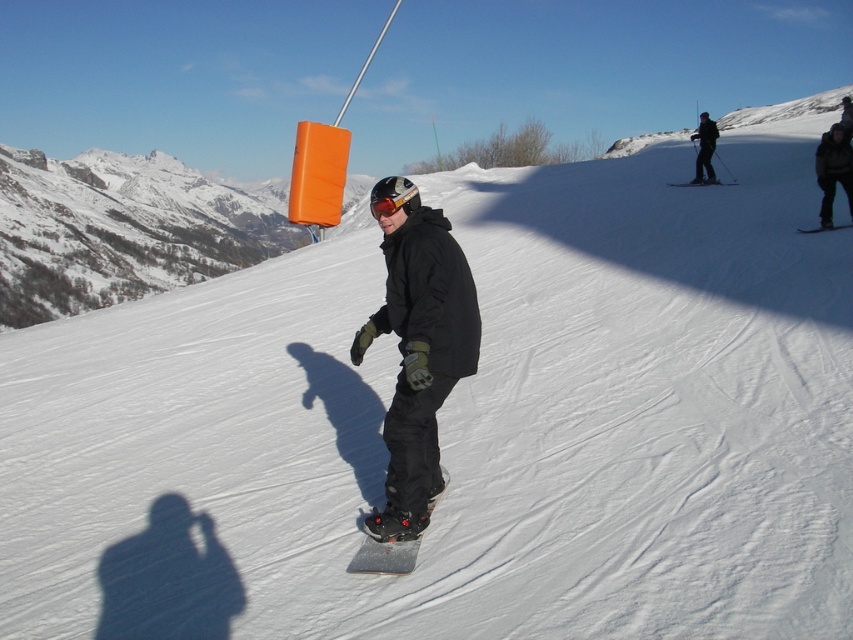
Can you confirm if red reflective goggles at center is positioned above matte black snowboard at upper center?

No, red reflective goggles at center is not above matte black snowboard at upper center.

The image size is (853, 640). In order to click on red reflective goggles at center in this screenshot , I will do `click(393, 196)`.

At what (x,y) coordinates should I click in order to perform the action: click on red reflective goggles at center. Please return your answer as a coordinate pair (x, y). Looking at the image, I should click on pyautogui.click(x=393, y=196).

Based on the photo, is matte black snowboarder at center positioned in front of matte black snowboard at center?

Yes, matte black snowboarder at center is closer to the viewer.

Between matte black snowboarder at center and matte black snowboard at center, which one appears on the right side from the viewer's perspective?

matte black snowboard at center is more to the right.

This screenshot has width=853, height=640. I want to click on matte black snowboarder at center, so click(x=419, y=356).

Is black matte snowboard at center below red reflective goggles at center?

Yes, black matte snowboard at center is below red reflective goggles at center.

Who is positioned more to the left, black matte snowboard at center or red reflective goggles at center?

red reflective goggles at center

The height and width of the screenshot is (640, 853). I want to click on black matte snowboard at center, so click(x=384, y=556).

At what (x,y) coordinates should I click in order to perform the action: click on black matte snowboard at center. Please return your answer as a coordinate pair (x, y). The width and height of the screenshot is (853, 640). Looking at the image, I should click on (384, 556).